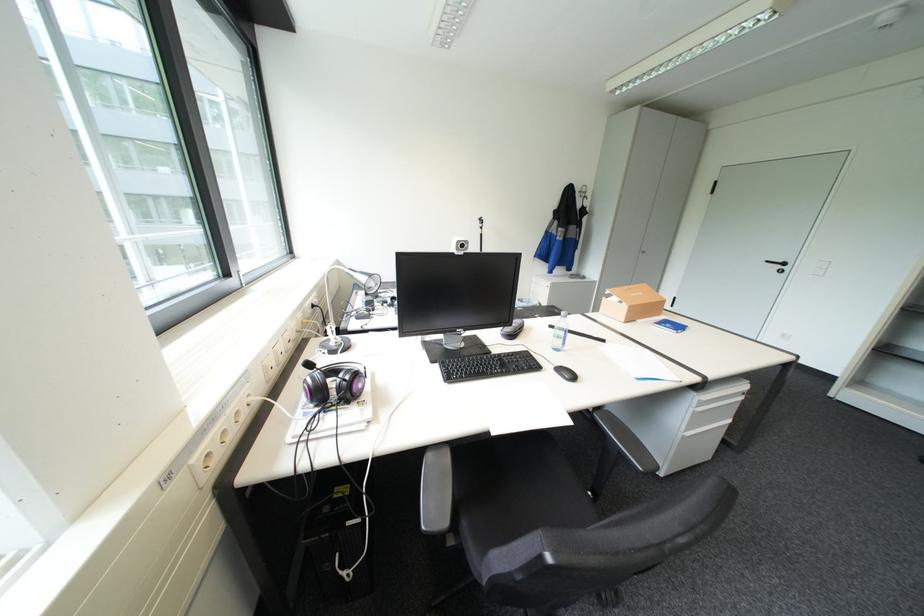
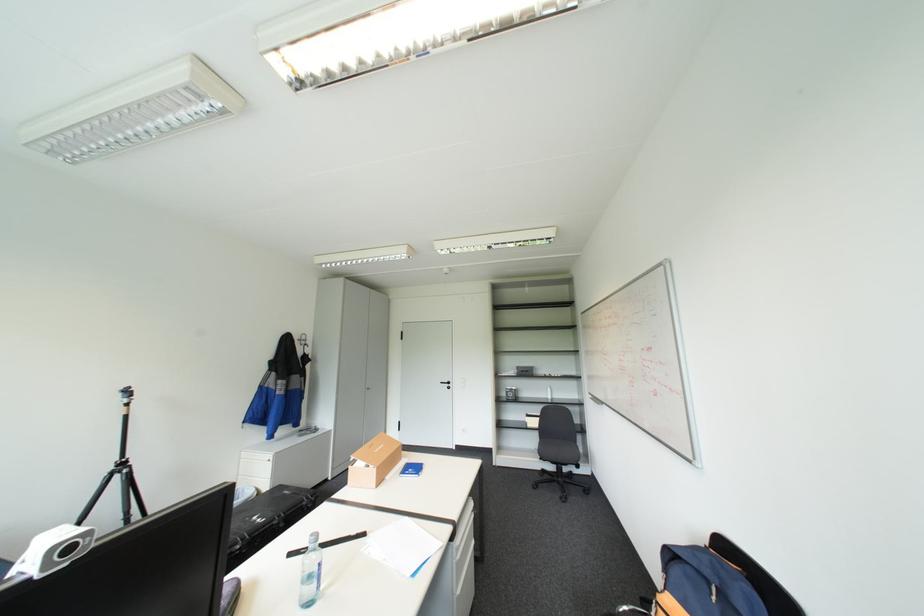
The point at (775, 261) is marked in the first image. Where is the corresponding point in the second image?

(450, 381)